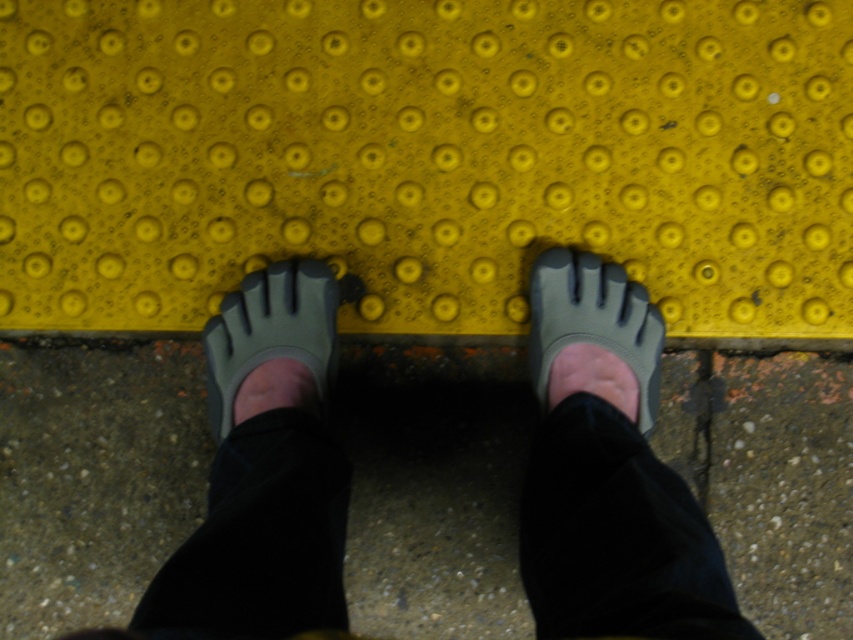
You are a visually impaired person using a cane to navigate. You feel the matte gray toe separator at center and the yellow rubber curb at center under your feet. Which object is located to the right of the other?

The matte gray toe separator at center is positioned on the right side of yellow rubber curb at center, so the matte gray toe separator at center is to the right of the yellow rubber curb at center.

You are a visually impaired individual trying to navigate using the tactile paving. You feel the matte gray toe separator at center and want to move to the concrete at center. In which direction should you move?

The concrete at center is positioned on the left side of the matte gray toe separator at center, so you should move to the left to reach the concrete at center.

From the picture: You are a visually impaired person using a cane to navigate. You come across the matte gray toe separator at center and the yellow rubber curb at center. Which object should you step over to avoid tripping?

The matte gray toe separator at center is much taller than the yellow rubber curb at center, so you should step over the matte gray toe separator at center to avoid tripping.